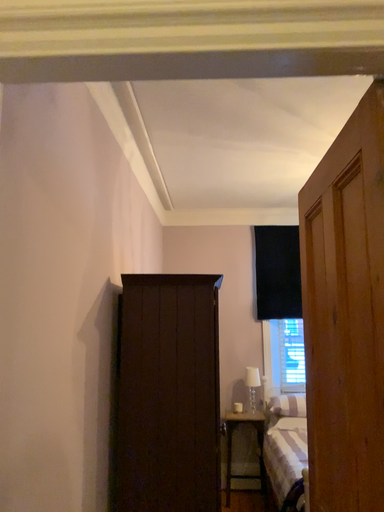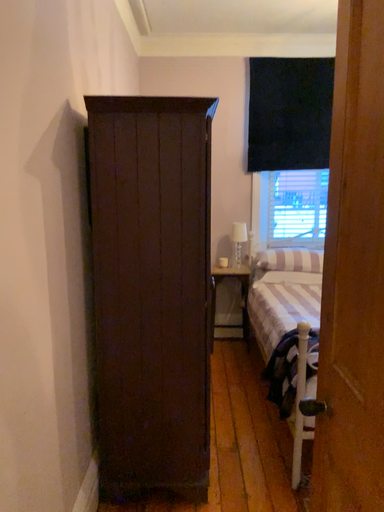
Question: How did the camera likely rotate when shooting the video?

Choices:
 (A) rotated downward
 (B) rotated upward

Answer: (A)